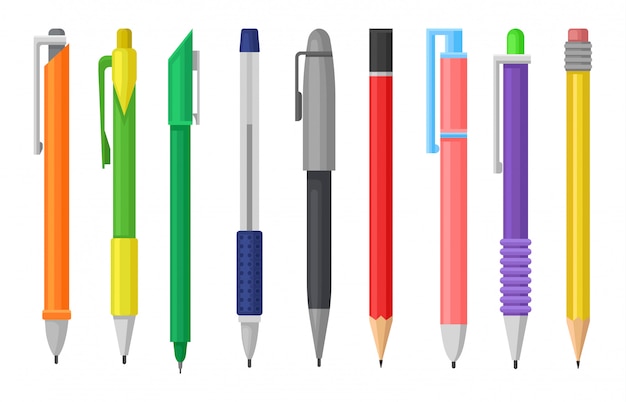
Identify the location of writing utensils. This screenshot has width=626, height=402. (578, 153), (516, 167), (453, 183), (377, 183), (325, 207), (245, 208), (181, 212), (126, 210), (57, 217).